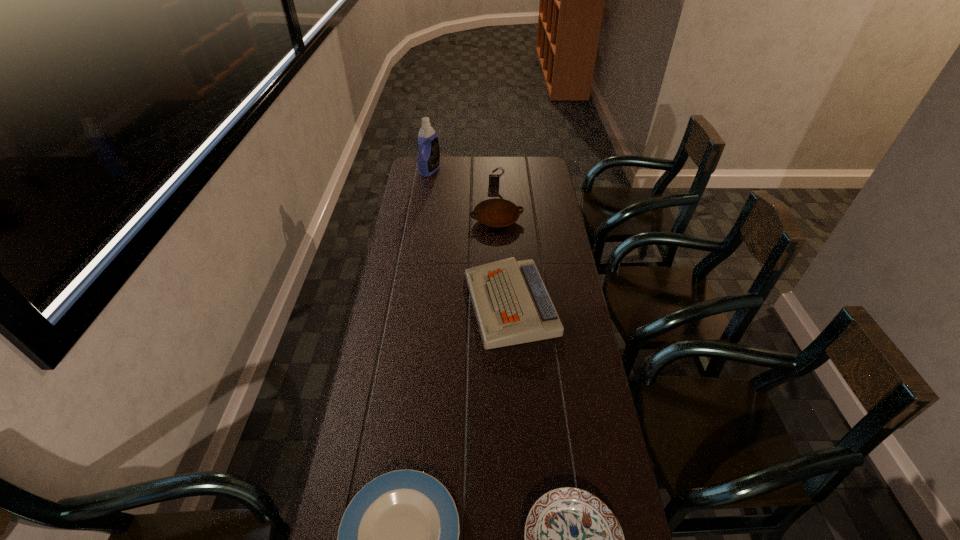
I want to click on free spot located 0.240m on the front of the computer keyboard, so click(518, 415).

This screenshot has width=960, height=540. In order to click on free space located on the right of the fourth tallest object in this screenshot , I will do `click(552, 220)`.

Find the location of a particular element. object positioned at the far edge is located at coordinates (x=428, y=160).

The image size is (960, 540). Identify the location of object present at the left edge. (428, 160).

This screenshot has width=960, height=540. I want to click on object located in the right edge section of the desktop, so click(511, 304).

What are the coordinates of `object present at the far left corner` in the screenshot? It's located at click(428, 160).

Image resolution: width=960 pixels, height=540 pixels. In the image, there is a desktop. Find the location of `free space at the far edge`. free space at the far edge is located at coordinates (466, 158).

The height and width of the screenshot is (540, 960). What are the coordinates of `free spot at the left edge of the desktop` in the screenshot? It's located at (415, 269).

Image resolution: width=960 pixels, height=540 pixels. I want to click on free space at the right edge of the desktop, so click(597, 455).

At what (x,y) coordinates should I click in order to perform the action: click on free space at the far right corner. Please return your answer as a coordinate pair (x, y). The width and height of the screenshot is (960, 540). Looking at the image, I should click on (540, 170).